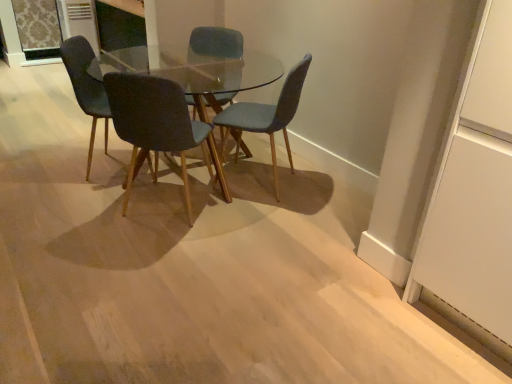
Find the location of a particular element. This screenshot has height=384, width=512. vacant area that is in front of textured blue chair at center, arranged as the 1th chair when viewed from the right is located at coordinates (263, 221).